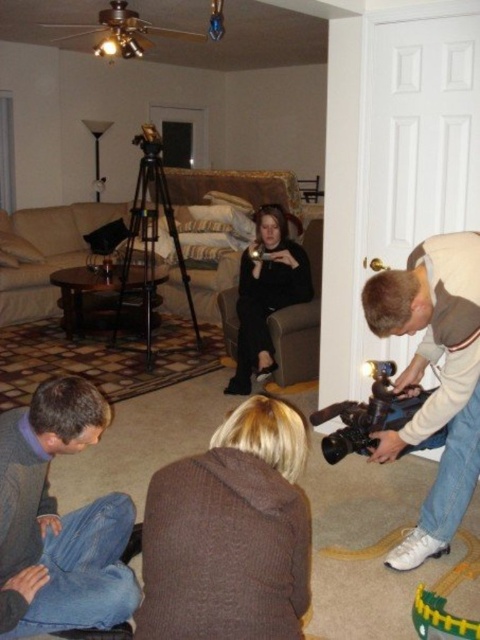
You are a photographer in a living room setting. You need to position a 36 inch wide camera equipment case between the black matte dress at center and the black metal tripod at center. Can the case fit in the space between them?

The space between the black matte dress at center and the black metal tripod at center is 37.65 inches. Since the case is 36 inches wide, it can fit as there is enough space.

You are a photographer setting up a shoot in the living room. You need to place a new prop between the brown fuzzy sweater at lower center and the black matte dress at center. Based on their current positions, where should you place the prop to ensure it is between them?

The brown fuzzy sweater at lower center is positioned on the left side of black matte dress at center, so placing the prop to the right of the brown fuzzy sweater at lower center and to the left of the black matte dress at center would place it between them.